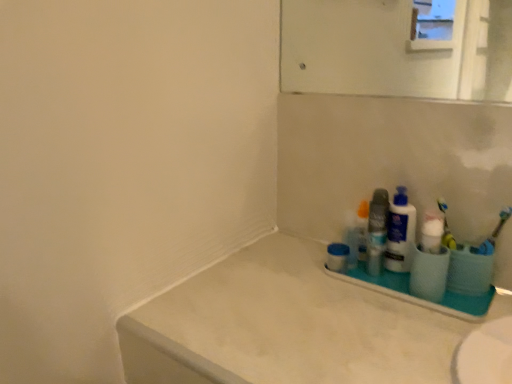
What are the coordinates of `free space to the left of translucent plastic bottles at right` in the screenshot? It's located at (298, 273).